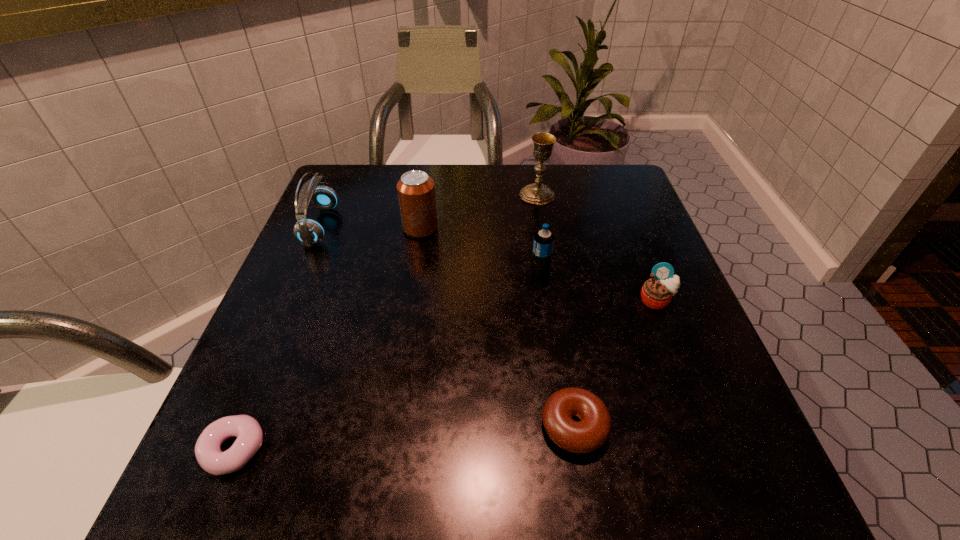
What are the coordinates of `doughnut present at the left edge` in the screenshot? It's located at (211, 458).

What are the coordinates of `object at the right edge` in the screenshot? It's located at (656, 293).

Image resolution: width=960 pixels, height=540 pixels. I want to click on object that is at the far left corner, so click(308, 231).

Locate an element on the screen. Image resolution: width=960 pixels, height=540 pixels. object situated at the near left corner is located at coordinates (211, 458).

Locate an element on the screen. The width and height of the screenshot is (960, 540). free region at the far edge of the desktop is located at coordinates (564, 183).

The height and width of the screenshot is (540, 960). I want to click on vacant space at the near edge of the desktop, so click(465, 495).

This screenshot has height=540, width=960. In order to click on free spot at the right edge of the desktop in this screenshot , I will do `click(620, 296)`.

Locate an element on the screen. vacant space at the far left corner of the desktop is located at coordinates (347, 190).

In the image, there is a desktop. Identify the location of free space at the near left corner. The height and width of the screenshot is (540, 960). (203, 496).

Where is `free space at the far right corner of the desktop`? Image resolution: width=960 pixels, height=540 pixels. free space at the far right corner of the desktop is located at coordinates (589, 166).